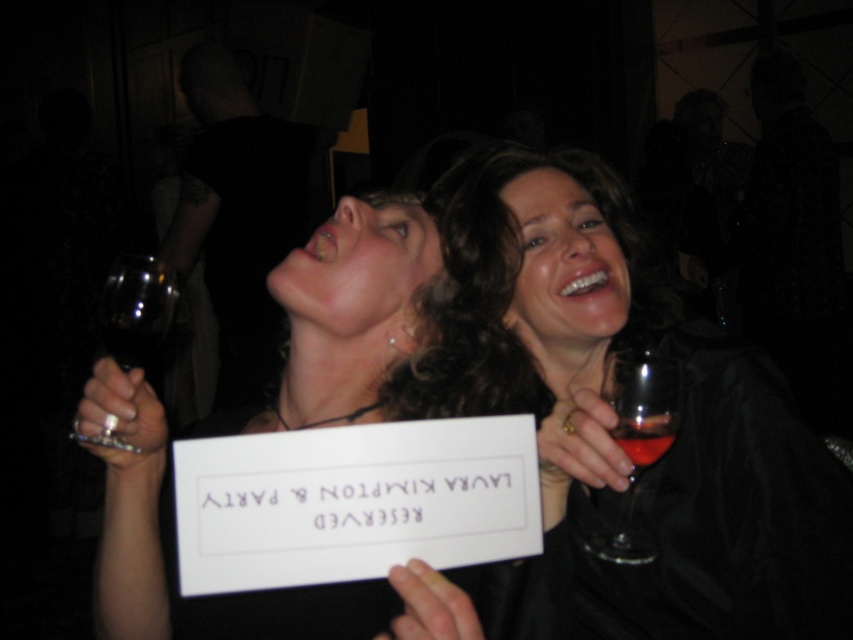
You are at a party and see two transparent glasses. One is the transparent glass at left and the other is the transparent glass at upper left. Which glass is taller?

The transparent glass at left is taller than the transparent glass at upper left.

You are at a party and see two glasses on the table. The matte black wine glass at upper right and the translucent glass at upper center. Which glass is higher up?

The matte black wine glass at upper right is above the translucent glass at upper center, so it is higher up.

You are at a party and need to place a new drink order. You see a matte white sign at center and a transparent glass at left. Which object is located to the right of the other?

The matte white sign at center is positioned on the right side of transparent glass at left.